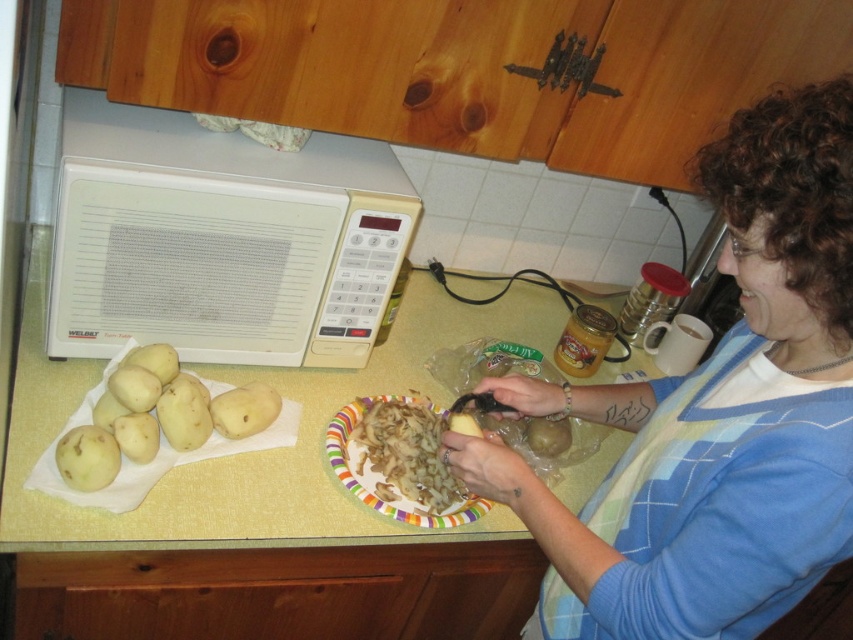
Does white glossy plate at center appear under smooth yellow potato at lower left?

Correct, white glossy plate at center is located below smooth yellow potato at lower left.

Who is lower down, white glossy plate at center or smooth yellow potato at lower left?

white glossy plate at center

Is point (360, 444) positioned in front of point (103, 449)?

No.

Locate an element on the screen. white glossy plate at center is located at coordinates (405, 452).

Can you confirm if blue knit sweater at upper right is smaller than smooth yellow potato at lower left?

No.

Is blue knit sweater at upper right below smooth yellow potato at lower left?

No.

Between point (744, 256) and point (94, 428), which one is positioned in front?

Point (744, 256) is more forward.

I want to click on blue knit sweater at upper right, so click(715, 413).

At what (x,y) coordinates should I click in order to perform the action: click on blue knit sweater at upper right. Please return your answer as a coordinate pair (x, y). Image resolution: width=853 pixels, height=640 pixels. Looking at the image, I should click on (715, 413).

Does blue knit sweater at upper right have a smaller size compared to yellow matte potato at center-left?

Actually, blue knit sweater at upper right might be larger than yellow matte potato at center-left.

Describe the element at coordinates (715, 413) in the screenshot. This screenshot has height=640, width=853. I see `blue knit sweater at upper right` at that location.

Where is `blue knit sweater at upper right`? This screenshot has width=853, height=640. blue knit sweater at upper right is located at coordinates (715, 413).